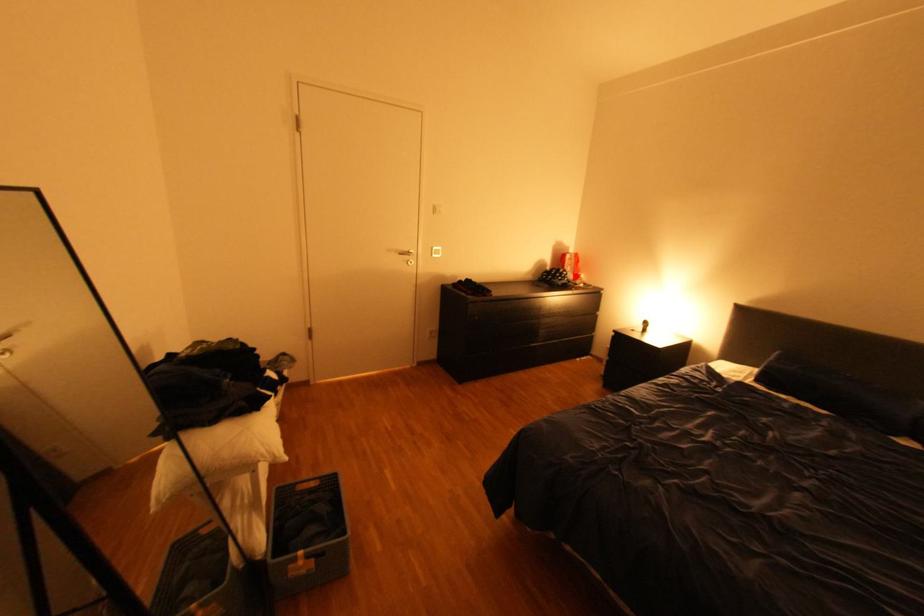
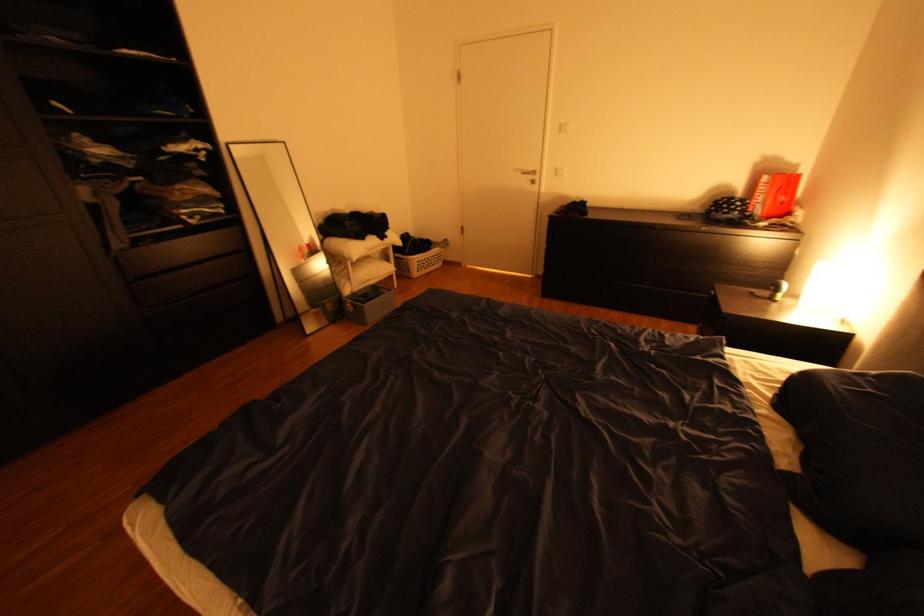
Where in the second image is the point corresponding to the highlighted location from the first image?

(748, 208)